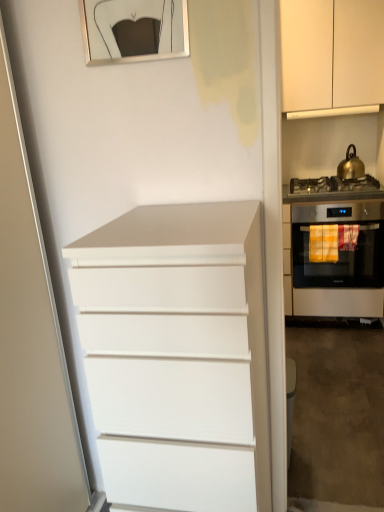
Identify the location of metallic gold picture frame at upper center. (132, 22).

The height and width of the screenshot is (512, 384). Describe the element at coordinates (336, 247) in the screenshot. I see `satin stainless steel oven at right` at that location.

The image size is (384, 512). Describe the element at coordinates (334, 185) in the screenshot. I see `satin silver gas stove at right` at that location.

The width and height of the screenshot is (384, 512). I want to click on white matte cabinet at upper right, so click(331, 53).

Where is `metallic gold picture frame at upper center`? This screenshot has width=384, height=512. metallic gold picture frame at upper center is located at coordinates (132, 22).

Does white matte cabinet at upper right have a smaller size compared to satin silver gas stove at right?

Incorrect, white matte cabinet at upper right is not smaller in size than satin silver gas stove at right.

How many degrees apart are the facing directions of white matte cabinet at upper right and satin silver gas stove at right?

0.223 degrees separate the facing orientations of white matte cabinet at upper right and satin silver gas stove at right.

Which point is more distant from viewer, (x=285, y=70) or (x=336, y=182)?

Point (x=336, y=182)

From the picture: From a real-world perspective, who is located lower, white matte cabinet at upper right or satin silver gas stove at right?

satin silver gas stove at right, from a real-world perspective.

Which of these two, white matte chest of drawers at center or gold metallic kettle at upper right, stands taller?

white matte chest of drawers at center.

Is white matte chest of drawers at center turned away from gold metallic kettle at upper right?

No.

Find the location of a particular element. This screenshot has width=384, height=512. kitchen appliance that is above the white matte chest of drawers at center (from a real-world perspective) is located at coordinates (350, 165).

Is white matte chest of drawers at center wider than gold metallic kettle at upper right?

Correct, the width of white matte chest of drawers at center exceeds that of gold metallic kettle at upper right.

Which is closer, (x=311, y=21) or (x=356, y=162)?

Point (x=311, y=21)

Considering the sizes of objects white matte cabinet at upper right and gold metallic kettle at upper right in the image provided, who is bigger, white matte cabinet at upper right or gold metallic kettle at upper right?

With larger size is white matte cabinet at upper right.

Are white matte cabinet at upper right and gold metallic kettle at upper right located far from each other?

No, there isn't a large distance between white matte cabinet at upper right and gold metallic kettle at upper right.

What's the angular difference between white matte chest of drawers at center and satin stainless steel oven at right's facing directions?

The angular difference between white matte chest of drawers at center and satin stainless steel oven at right is 1.44 degrees.

Which is behind, point (202, 398) or point (313, 275)?

The point (313, 275) is farther from the camera.

From the image's perspective, which is below, white matte chest of drawers at center or satin stainless steel oven at right?

white matte chest of drawers at center, from the image's perspective.

Does white matte chest of drawers at center have a lesser height compared to satin stainless steel oven at right?

Incorrect, the height of white matte chest of drawers at center does not fall short of that of satin stainless steel oven at right.

Which point is more forward, (88, 16) or (192, 316)?

The point (192, 316) is closer to the camera.

Looking at this image, measure the distance between metallic gold picture frame at upper center and white matte chest of drawers at center.

metallic gold picture frame at upper center and white matte chest of drawers at center are 32.89 inches apart from each other.

Considering the relative positions of metallic gold picture frame at upper center and white matte chest of drawers at center in the image provided, is metallic gold picture frame at upper center to the left of white matte chest of drawers at center from the viewer's perspective?

Yes.

Is metallic gold picture frame at upper center looking in the opposite direction of white matte chest of drawers at center?

No, metallic gold picture frame at upper center's orientation is not away from white matte chest of drawers at center.

From the image's perspective, is gold metallic kettle at upper right over satin silver gas stove at right?

Yes, from the image's perspective, gold metallic kettle at upper right is on top of satin silver gas stove at right.

Is gold metallic kettle at upper right taller or shorter than satin silver gas stove at right?

Clearly, gold metallic kettle at upper right is taller compared to satin silver gas stove at right.

Looking at this image, can satin silver gas stove at right be found inside gold metallic kettle at upper right?

No, satin silver gas stove at right is not inside gold metallic kettle at upper right.

Between gold metallic kettle at upper right and satin silver gas stove at right, which one appears on the left side from the viewer's perspective?

satin silver gas stove at right is more to the left.

Is gold metallic kettle at upper right at the left side of white matte cabinet at upper right?

No, gold metallic kettle at upper right is not to the left of white matte cabinet at upper right.

Between gold metallic kettle at upper right and white matte cabinet at upper right, which one has larger width?

white matte cabinet at upper right.

From the image's perspective, would you say gold metallic kettle at upper right is shown under white matte cabinet at upper right?

Correct, gold metallic kettle at upper right appears lower than white matte cabinet at upper right in the image.

Identify the location of cabinetry above the satin silver gas stove at right (from a real-world perspective). The height and width of the screenshot is (512, 384). (331, 53).

Identify the location of the chest of drawers that appears below the gold metallic kettle at upper right (from a real-world perspective). (177, 355).

Estimate the real-world distances between objects in this image. Which object is closer to gold metallic kettle at upper right, white matte chest of drawers at center or satin stainless steel oven at right?

satin stainless steel oven at right lies closer to gold metallic kettle at upper right than the other object.

Based on their spatial positions, is satin stainless steel oven at right or metallic gold picture frame at upper center closer to white matte chest of drawers at center?

metallic gold picture frame at upper center.

Estimate the real-world distances between objects in this image. Which object is closer to gold metallic kettle at upper right, satin silver gas stove at right or satin stainless steel oven at right?

satin silver gas stove at right is positioned closer to the anchor gold metallic kettle at upper right.

Considering their positions, is white matte chest of drawers at center positioned further to white matte cabinet at upper right than metallic gold picture frame at upper center?

white matte chest of drawers at center.

Looking at the image, which one is located further to white matte cabinet at upper right, gold metallic kettle at upper right or satin stainless steel oven at right?

Based on the image, satin stainless steel oven at right appears to be further to white matte cabinet at upper right.

Based on their spatial positions, is metallic gold picture frame at upper center or satin stainless steel oven at right closer to satin silver gas stove at right?

satin stainless steel oven at right is closer to satin silver gas stove at right.

Looking at the image, which one is located further to satin stainless steel oven at right, satin silver gas stove at right or white matte cabinet at upper right?

white matte cabinet at upper right is further to satin stainless steel oven at right.

From the picture: Estimate the real-world distances between objects in this image. Which object is closer to satin silver gas stove at right, white matte cabinet at upper right or white matte chest of drawers at center?

white matte cabinet at upper right lies closer to satin silver gas stove at right than the other object.

Locate an element on the screen. The image size is (384, 512). cabinetry located between metallic gold picture frame at upper center and satin silver gas stove at right in the depth direction is located at coordinates (331, 53).

The width and height of the screenshot is (384, 512). Find the location of `home appliance positioned between metallic gold picture frame at upper center and gold metallic kettle at upper right from near to far`. home appliance positioned between metallic gold picture frame at upper center and gold metallic kettle at upper right from near to far is located at coordinates (336, 247).

Where is `picture frame between white matte cabinet at upper right and white matte chest of drawers at center vertically`? picture frame between white matte cabinet at upper right and white matte chest of drawers at center vertically is located at coordinates (132, 22).

The height and width of the screenshot is (512, 384). I want to click on home appliance between white matte chest of drawers at center and gold metallic kettle at upper right from front to back, so click(x=336, y=247).